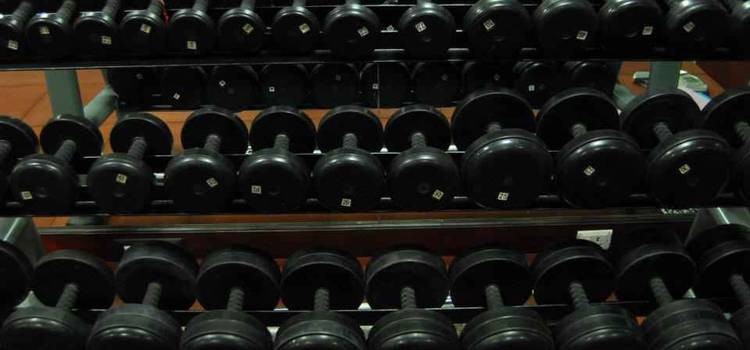
What are the coordinates of `dumbbell rack 1` in the screenshot? It's located at [361, 315].